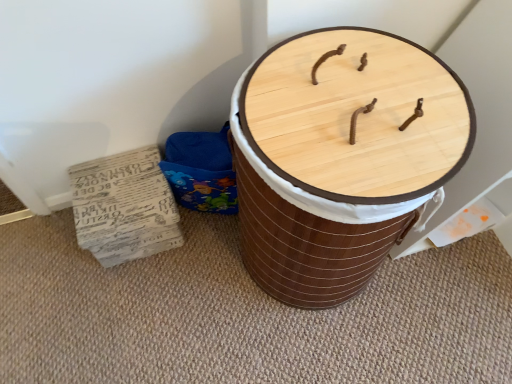
Question: Is recycled paper stack at lower left wider or thinner than wooden barrel at center?

Choices:
 (A) wide
 (B) thin

Answer: (B)

Question: From their relative heights in the image, would you say recycled paper stack at lower left is taller or shorter than wooden barrel at center?

Choices:
 (A) short
 (B) tall

Answer: (A)

Question: From the image's perspective, is recycled paper stack at lower left positioned above or below wooden barrel at center?

Choices:
 (A) below
 (B) above

Answer: (A)

Question: Considering the positions of wooden barrel at center and recycled paper stack at lower left in the image, is wooden barrel at center wider or thinner than recycled paper stack at lower left?

Choices:
 (A) wide
 (B) thin

Answer: (A)

Question: In terms of height, does wooden barrel at center look taller or shorter compared to recycled paper stack at lower left?

Choices:
 (A) tall
 (B) short

Answer: (A)

Question: Is wooden barrel at center inside the boundaries of recycled paper stack at lower left, or outside?

Choices:
 (A) inside
 (B) outside

Answer: (B)

Question: From the image's perspective, is wooden barrel at center positioned above or below recycled paper stack at lower left?

Choices:
 (A) above
 (B) below

Answer: (A)